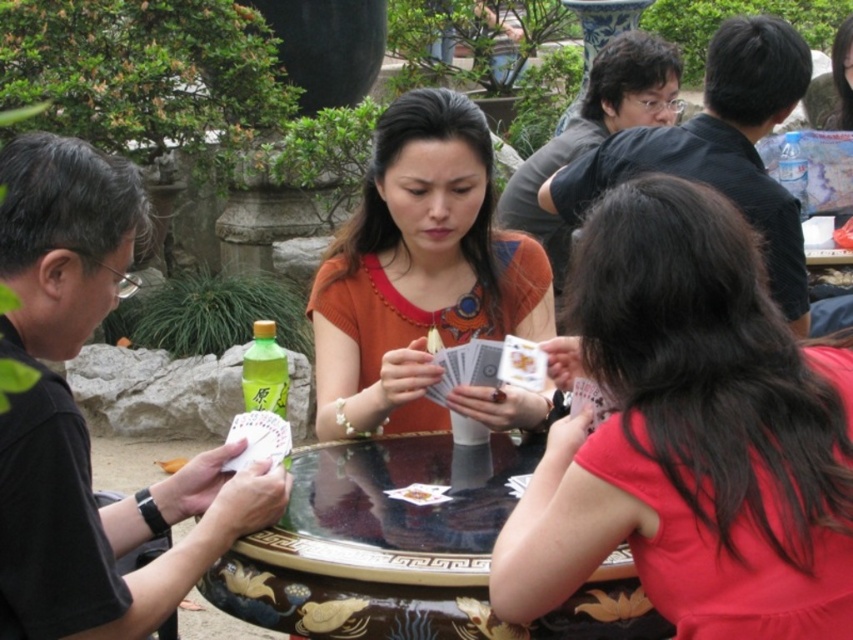
You are a photographer trying to capture a candid shot of the matte red shirt at lower right and the orange knitted sweater at center. Since you want to ensure both are clearly visible in the frame, which subject should you prioritize focusing on to account for their sizes?

The matte red shirt at lower right is smaller in size compared to the orange knitted sweater at center. To ensure both are clearly visible, focus on the orange knitted sweater at center first as it occupies more space in the frame, then adjust focus to the smaller matte red shirt at lower right.

You are a photographer trying to capture a closeup of the matte red shirt at lower right and the matte black shirt at upper right. Since you want both shirts to be clearly visible in the photo, which shirt should you focus on to ensure the larger one is in focus?

You should focus on the matte red shirt at lower right because it is bigger than the matte black shirt at upper right, so ensuring it is in focus will help both shirts appear clear.